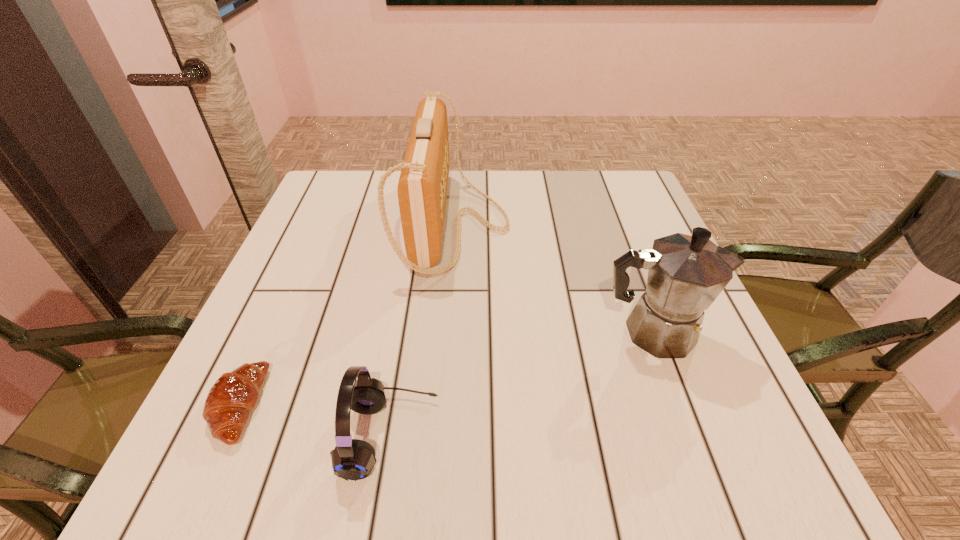
This screenshot has height=540, width=960. Find the location of `handbag`. handbag is located at coordinates (422, 188).

This screenshot has height=540, width=960. What are the coordinates of `the third nearest object` in the screenshot? It's located at (686, 274).

Where is `the rightmost object`? The width and height of the screenshot is (960, 540). the rightmost object is located at coordinates (686, 274).

In order to click on the third tallest object in this screenshot , I will do `click(352, 459)`.

This screenshot has width=960, height=540. In order to click on the shortest object in this screenshot , I will do `click(233, 396)`.

This screenshot has width=960, height=540. What are the coordinates of `the leftmost object` in the screenshot? It's located at (233, 396).

Locate an element on the screen. The image size is (960, 540). vacant space situated 0.360m on the decorative side of the handbag is located at coordinates (653, 224).

Locate an element on the screen. This screenshot has width=960, height=540. vacant position located on the ear cushions of the headset is located at coordinates (544, 436).

Where is `free spot located on the right of the crescent roll`? The width and height of the screenshot is (960, 540). free spot located on the right of the crescent roll is located at coordinates (496, 406).

You are a GUI agent. You are given a task and a screenshot of the screen. Output one action in this format:
    pyautogui.click(x=<x>, y=<y>)
    Task: Click on the object located at the far edge
    This screenshot has height=540, width=960.
    Given the screenshot: What is the action you would take?
    pyautogui.click(x=422, y=188)